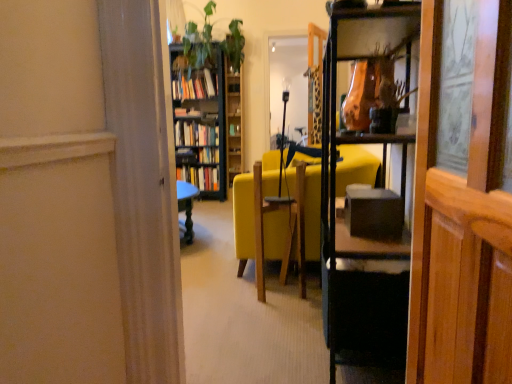
Question: Is black glossy table at center positioned far away from hardcover book at center, the third book positioned from the top?

Choices:
 (A) yes
 (B) no

Answer: (A)

Question: Does black glossy table at center have a smaller size compared to hardcover book at center, the third book positioned from the top?

Choices:
 (A) no
 (B) yes

Answer: (A)

Question: Is black glossy table at center oriented towards hardcover book at center, the third book positioned from the top?

Choices:
 (A) yes
 (B) no

Answer: (B)

Question: Is black glossy table at center further to camera compared to hardcover book at center, marked as the 1th book in a bottom-to-top arrangement?

Choices:
 (A) yes
 (B) no

Answer: (B)

Question: Is black glossy table at center outside hardcover book at center, marked as the 1th book in a bottom-to-top arrangement?

Choices:
 (A) no
 (B) yes

Answer: (B)

Question: Considering the relative sizes of black glossy table at center and hardcover book at center, the third book positioned from the top, in the image provided, is black glossy table at center shorter than hardcover book at center, the third book positioned from the top,?

Choices:
 (A) no
 (B) yes

Answer: (A)

Question: Considering the relative sizes of hardcover books at center, which appears as the second book when ordered from the bottom, and green leafy plant at upper center in the image provided, is hardcover books at center, which appears as the second book when ordered from the bottom, wider than green leafy plant at upper center?

Choices:
 (A) no
 (B) yes

Answer: (A)

Question: Considering the relative sizes of hardcover books at center, the second book positioned from the top, and green leafy plant at upper center in the image provided, is hardcover books at center, the second book positioned from the top, smaller than green leafy plant at upper center?

Choices:
 (A) no
 (B) yes

Answer: (B)

Question: Does hardcover books at center, which appears as the second book when ordered from the bottom, appear on the right side of green leafy plant at upper center?

Choices:
 (A) no
 (B) yes

Answer: (A)

Question: From a real-world perspective, is hardcover books at center, which appears as the second book when ordered from the bottom, located beneath green leafy plant at upper center?

Choices:
 (A) no
 (B) yes

Answer: (B)

Question: Is green leafy plant at upper center located within hardcover books at center, which appears as the second book when ordered from the bottom?

Choices:
 (A) no
 (B) yes

Answer: (A)

Question: Is hardcover books at center, the second book positioned from the top, far from green leafy plant at upper center?

Choices:
 (A) no
 (B) yes

Answer: (A)

Question: Is wooden bookcase at center at the back of hardcover books at center, which ranks as the first book in top-to-bottom order?

Choices:
 (A) yes
 (B) no

Answer: (A)